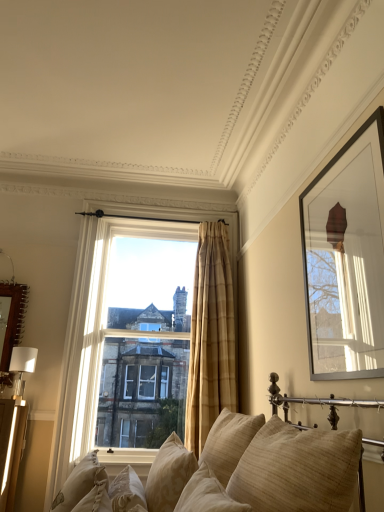
Question: Considering the relative sizes of beige textured pillow at lower center, which is the 5th pillow in right-to-left order, and beige textured pillow at lower center, acting as the 4th pillow starting from the right, in the image provided, is beige textured pillow at lower center, which is the 5th pillow in right-to-left order, smaller than beige textured pillow at lower center, acting as the 4th pillow starting from the right,?

Choices:
 (A) yes
 (B) no

Answer: (A)

Question: Is beige textured pillow at lower center, which is the 5th pillow in right-to-left order, bigger than beige textured pillow at lower center, which is the 3th pillow from left to right?

Choices:
 (A) no
 (B) yes

Answer: (A)

Question: Considering the relative sizes of beige textured pillow at lower center, which is the 5th pillow in right-to-left order, and beige textured pillow at lower center, which is the 3th pillow from left to right, in the image provided, is beige textured pillow at lower center, which is the 5th pillow in right-to-left order, taller than beige textured pillow at lower center, which is the 3th pillow from left to right,?

Choices:
 (A) yes
 (B) no

Answer: (B)

Question: Is beige textured pillow at lower center, which ranks as the 2th pillow in left-to-right order, facing away from beige textured pillow at lower center, which is the 3th pillow from left to right?

Choices:
 (A) no
 (B) yes

Answer: (B)

Question: From a real-world perspective, is beige textured pillow at lower center, which ranks as the 2th pillow in left-to-right order, physically above beige textured pillow at lower center, acting as the 4th pillow starting from the right?

Choices:
 (A) yes
 (B) no

Answer: (B)

Question: In terms of width, does clear glass window at center look wider or thinner when compared to beige textured pillow at lower center, acting as the 4th pillow starting from the right?

Choices:
 (A) wide
 (B) thin

Answer: (A)

Question: From a real-world perspective, is clear glass window at center physically located above or below beige textured pillow at lower center, which is the 3th pillow from left to right?

Choices:
 (A) above
 (B) below

Answer: (A)

Question: Visually, is clear glass window at center positioned to the left or to the right of beige textured pillow at lower center, which is the 3th pillow from left to right?

Choices:
 (A) right
 (B) left

Answer: (B)

Question: Does point (190, 231) appear closer or farther from the camera than point (175, 480)?

Choices:
 (A) farther
 (B) closer

Answer: (A)

Question: From the image's perspective, is beige textured pillow at lower center, acting as the 4th pillow starting from the right, located above or below matte black picture frame at upper right, marked as the first picture frame in a front-to-back arrangement?

Choices:
 (A) above
 (B) below

Answer: (B)

Question: Is beige textured pillow at lower center, acting as the 4th pillow starting from the right, to the left or to the right of matte black picture frame at upper right, marked as the first picture frame in a front-to-back arrangement, in the image?

Choices:
 (A) right
 (B) left

Answer: (B)

Question: In terms of height, does beige textured pillow at lower center, acting as the 4th pillow starting from the right, look taller or shorter compared to matte black picture frame at upper right, marked as the first picture frame in a front-to-back arrangement?

Choices:
 (A) tall
 (B) short

Answer: (B)

Question: In the image, is beige textured pillow at lower center, acting as the 4th pillow starting from the right, positioned in front of or behind matte black picture frame at upper right, the 2th picture frame when ordered from left to right?

Choices:
 (A) behind
 (B) front

Answer: (A)

Question: Is point (16, 321) positioned closer to the camera than point (253, 478)?

Choices:
 (A) farther
 (B) closer

Answer: (A)

Question: In the image, is wooden mirror at left, which is the 1th picture frame in back-to-front order, on the left side or the right side of beige fabric couch at center?

Choices:
 (A) left
 (B) right

Answer: (A)